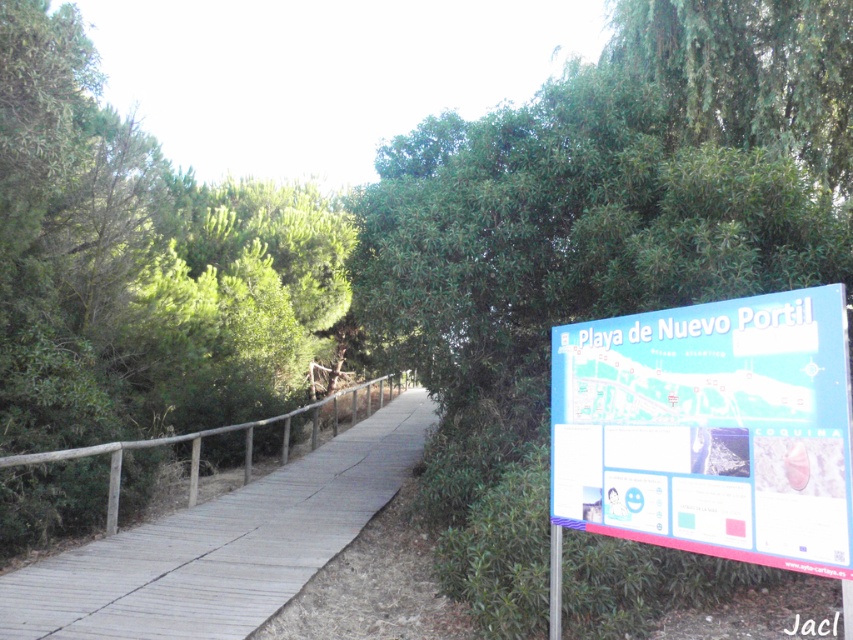
You are a hiker who wants to take a photo of both the green leafy tree at left and the blue plastic sign at right in the same frame. Based on their widths, is it possible to capture both in one shot without moving the camera?

The green leafy tree at left might be wider than blue plastic sign at right, so it depends on the camera angle and distance. If the tree is wider, you might need to position the camera further back to include both in the frame.

You are a hiker who wants to take a photo of the green leafy tree at left and the wooden at left from the boardwalk. Which object should you stand closer to in order to capture both in the same frame?

The green leafy tree at left is above the wooden at left, so you should stand closer to the wooden at left to include both in the same frame.